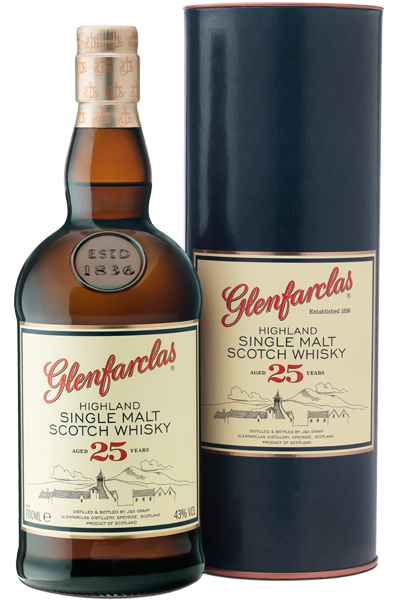
The height and width of the screenshot is (600, 400). Find the location of `bottle`. bottle is located at coordinates (118, 301).